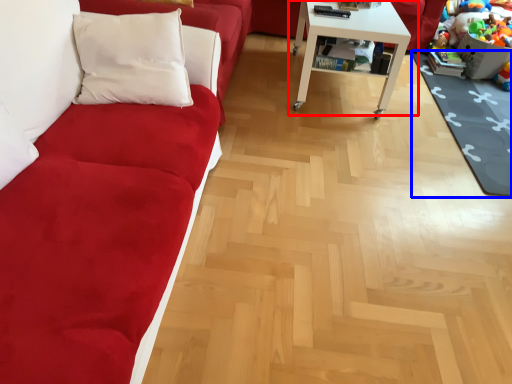
Question: Which object is closer to the camera taking this photo, table (highlighted by a red box) or mat (highlighted by a blue box)?

Choices:
 (A) table
 (B) mat

Answer: (B)